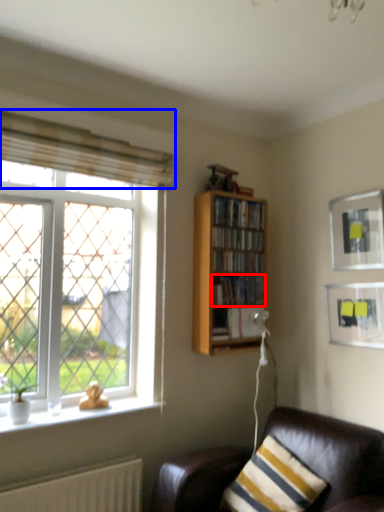
Question: Among these objects, which one is farthest to the camera, book (highlighted by a red box) or curtain (highlighted by a blue box)?

Choices:
 (A) book
 (B) curtain

Answer: (A)